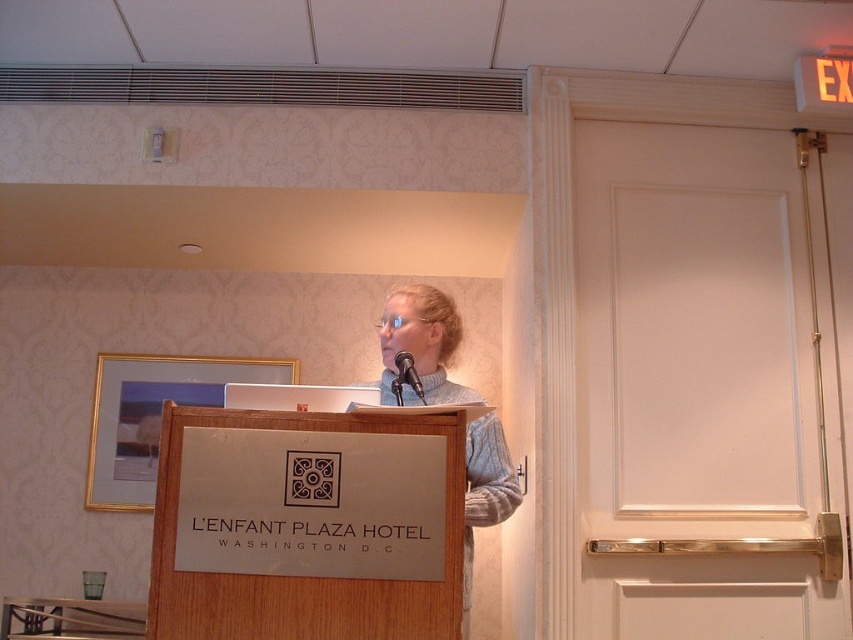
Question: Which of the following is the farthest from the observer?

Choices:
 (A) black metallic microphone at center
 (B) gray wool sweater at center

Answer: (A)

Question: Where is gray wool sweater at center located in relation to black metallic microphone at center in the image?

Choices:
 (A) right
 (B) left

Answer: (A)

Question: Is gray wool sweater at center to the left of black metallic microphone at center from the viewer's perspective?

Choices:
 (A) yes
 (B) no

Answer: (B)

Question: Observing the image, what is the correct spatial positioning of gray wool sweater at center in reference to black metallic microphone at center?

Choices:
 (A) left
 (B) right

Answer: (B)

Question: Which point appears farthest from the camera in this image?

Choices:
 (A) (479, 486)
 (B) (396, 368)

Answer: (A)

Question: Among these objects, which one is nearest to the camera?

Choices:
 (A) gray wool sweater at center
 (B) black metallic microphone at center

Answer: (A)